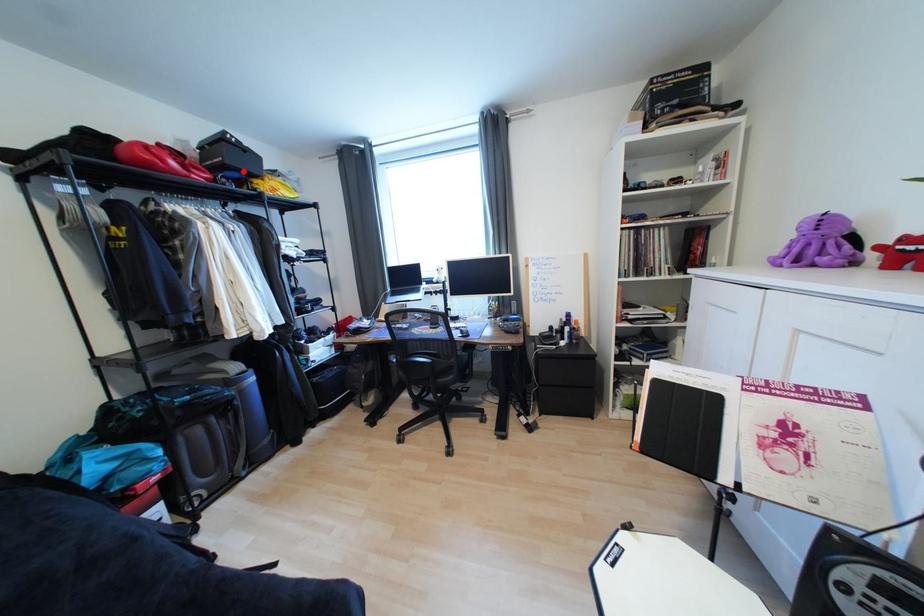
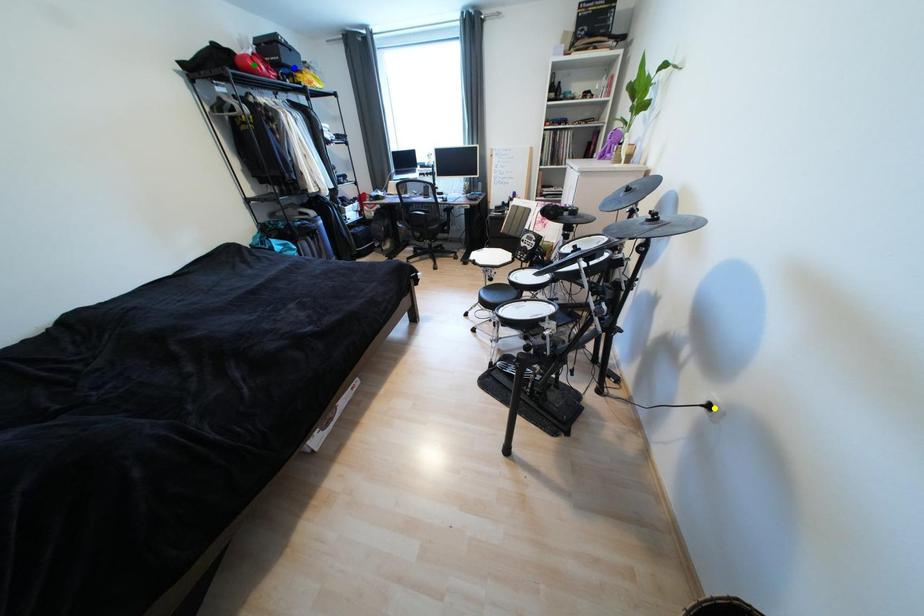
Question: I am providing you with two images of the same scene from different viewpoints. A red point is marked on the first image. You are given multiple points on the second image. In image 2, which mark is for the same physical point as the one in image 1?

Choices:
 (A) green point
 (B) blue point
 (C) yellow point

Answer: (B)